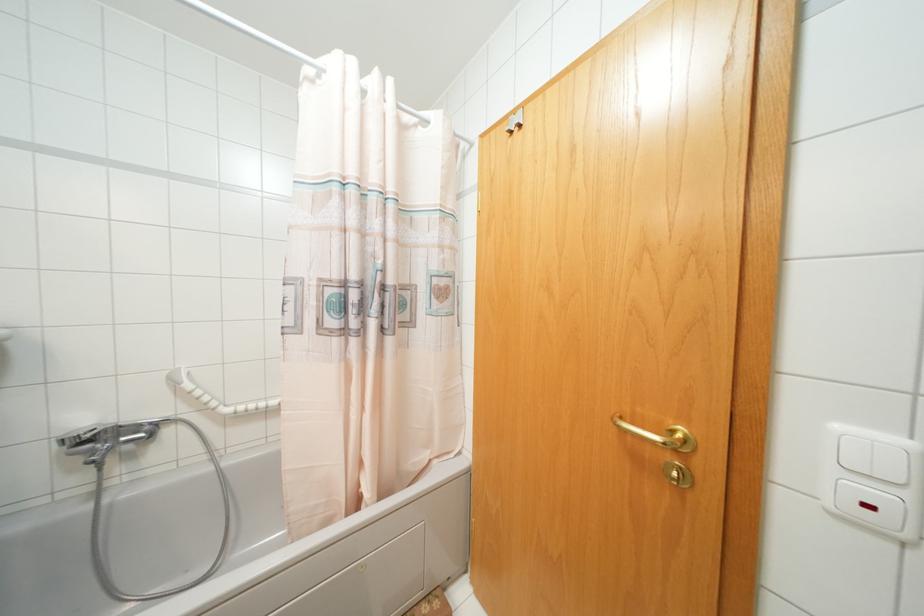
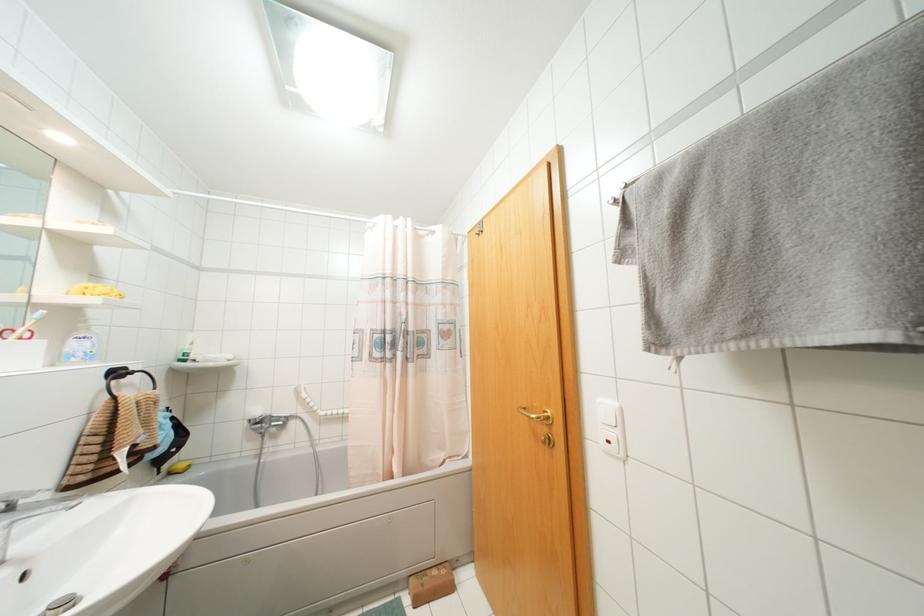
Find the pixel in the second image that matches pixel 686 440 in the first image.

(546, 416)